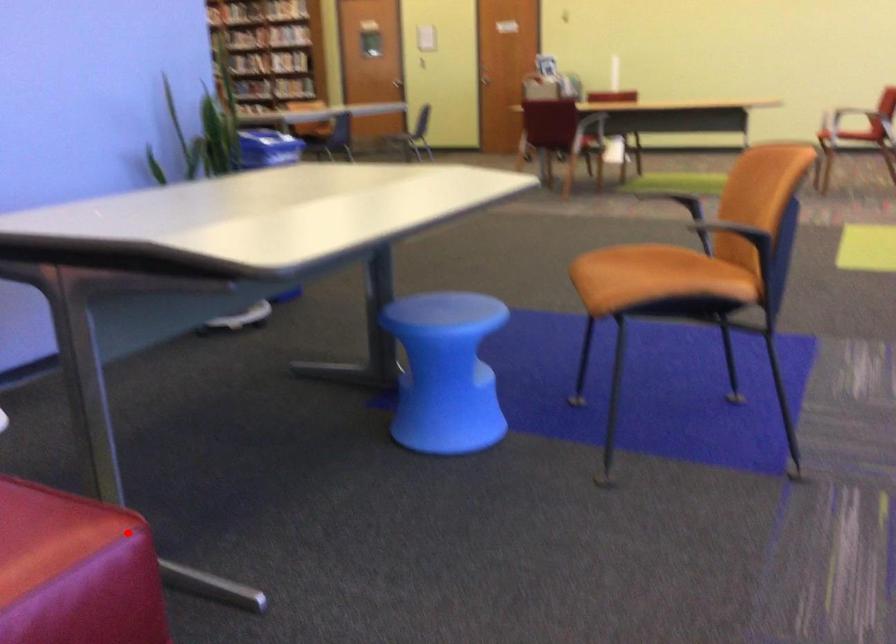
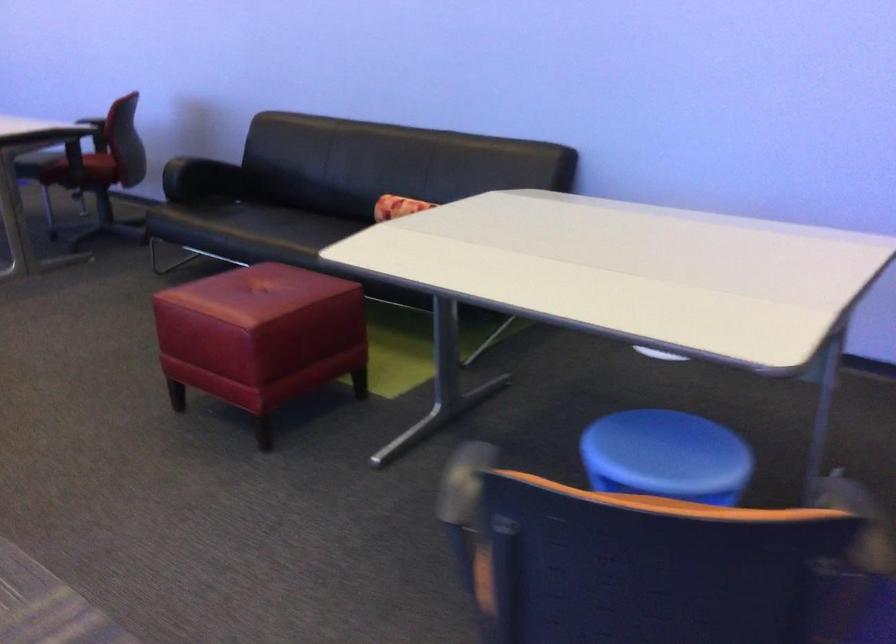
In the second image, find the point that corresponds to the highlighted location in the first image.

(261, 337)